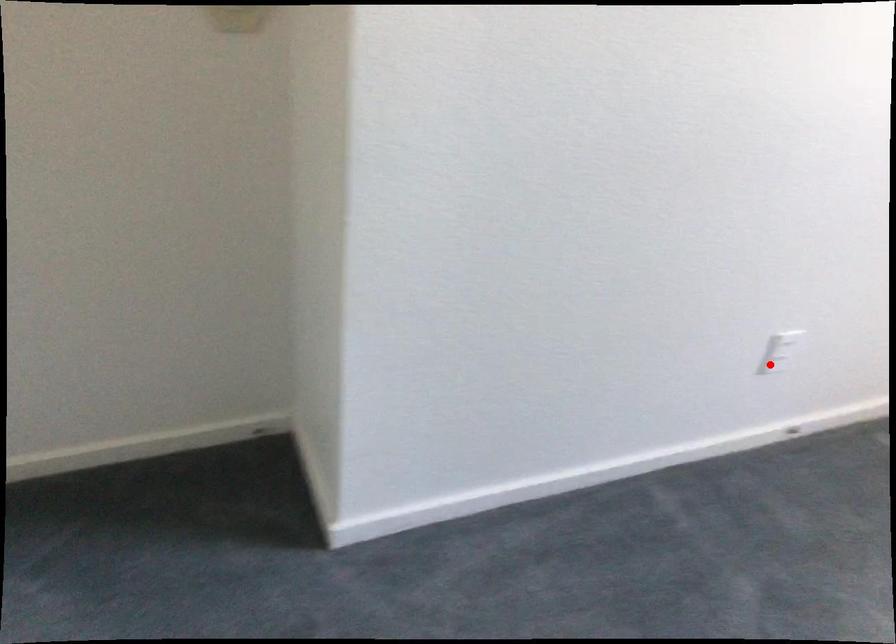
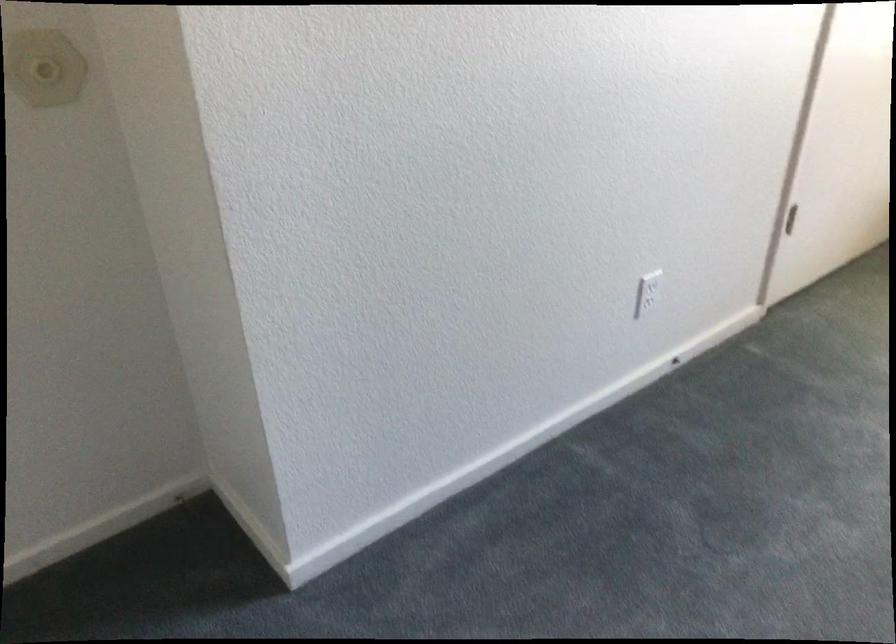
Locate, in the second image, the point that corresponds to the highlighted location in the first image.

(645, 303)